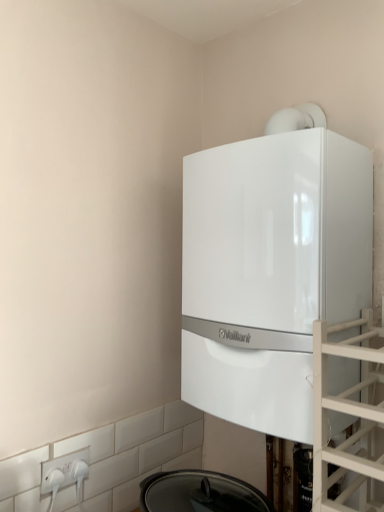
Locate an element on the screen. This screenshot has width=384, height=512. white glossy boiler at upper center is located at coordinates (270, 270).

Locate an element on the screen. home appliance lying behind the transparent glass door at right is located at coordinates (270, 270).

From the image's perspective, is transparent glass door at right above or below white glossy boiler at upper center?

From the image's perspective, transparent glass door at right appears below white glossy boiler at upper center.

Can you tell me how much transparent glass door at right and white glossy boiler at upper center differ in facing direction?

transparent glass door at right and white glossy boiler at upper center are facing 0.709 degrees away from each other.

Between transparent glass door at right and white glossy boiler at upper center, which one appears on the left side from the viewer's perspective?

white glossy boiler at upper center is more to the left.

How different are the orientations of transparent glass door at right and white plastic electric outlet at lower left in degrees?

The facing directions of transparent glass door at right and white plastic electric outlet at lower left are 90 degrees apart.

In order to click on glass door on the right of white plastic electric outlet at lower left in this screenshot , I will do `click(348, 414)`.

Is transparent glass door at right looking in the opposite direction of white plastic electric outlet at lower left?

No, transparent glass door at right is not facing the opposite direction of white plastic electric outlet at lower left.

From the image's perspective, between transparent glass door at right and white plastic electric outlet at lower left, which one is located above?

transparent glass door at right is shown above in the image.

Does white plastic electric outlet at lower left come behind transparent glass door at right?

Yes, white plastic electric outlet at lower left is further from the viewer.

Is white plastic electric outlet at lower left positioned far away from transparent glass door at right?

white plastic electric outlet at lower left is near transparent glass door at right, not far away.

The height and width of the screenshot is (512, 384). There is a white plastic electric outlet at lower left. What are the coordinates of `glass door above it (from a real-world perspective)` in the screenshot? It's located at (348, 414).

Based on the photo, is white plastic electric outlet at lower left taller than white glossy boiler at upper center?

In fact, white plastic electric outlet at lower left may be shorter than white glossy boiler at upper center.

Between white plastic electric outlet at lower left and white glossy boiler at upper center, which one has larger size?

Bigger between the two is white glossy boiler at upper center.

From the image's perspective, which is above, white plastic electric outlet at lower left or white glossy boiler at upper center?

white glossy boiler at upper center, from the image's perspective.

Consider the image. In terms of width, does white plastic electric outlet at lower left look wider or thinner when compared to white glossy boiler at upper center?

In the image, white plastic electric outlet at lower left appears to be more narrow than white glossy boiler at upper center.

From the image's perspective, between white glossy boiler at upper center and transparent glass door at right, which one is located above?

white glossy boiler at upper center, from the image's perspective.

How different are the orientations of white glossy boiler at upper center and transparent glass door at right in degrees?

white glossy boiler at upper center and transparent glass door at right are facing 0.709 degrees away from each other.

Which is less distant, (295, 306) or (365, 319)?

The point (295, 306) is in front.

Is white glossy boiler at upper center far away from transparent glass door at right?

No, white glossy boiler at upper center is not far away from transparent glass door at right.

Find the location of a particular element. This screenshot has width=384, height=512. electric outlet that is under the white glossy boiler at upper center (from a real-world perspective) is located at coordinates (65, 471).

Is white glossy boiler at upper center facing towards white plastic electric outlet at lower left?

No, white glossy boiler at upper center is not oriented towards white plastic electric outlet at lower left.

Does white glossy boiler at upper center have a greater width compared to white plastic electric outlet at lower left?

Yes, white glossy boiler at upper center is wider than white plastic electric outlet at lower left.

How distant is white glossy boiler at upper center from white plastic electric outlet at lower left?

white glossy boiler at upper center and white plastic electric outlet at lower left are 28.05 inches apart from each other.

The image size is (384, 512). In order to click on glass door below the white glossy boiler at upper center (from the image's perspective) in this screenshot , I will do `click(348, 414)`.

Find the location of `electric outlet to the left of transparent glass door at right`. electric outlet to the left of transparent glass door at right is located at coordinates (65, 471).

Considering their positions, is white glossy boiler at upper center positioned closer to white plastic electric outlet at lower left than transparent glass door at right?

The object closer to white plastic electric outlet at lower left is white glossy boiler at upper center.

From the image, which object appears to be nearer to white glossy boiler at upper center, white plastic electric outlet at lower left or transparent glass door at right?

transparent glass door at right is closer to white glossy boiler at upper center.

When comparing their distances from transparent glass door at right, does white plastic electric outlet at lower left or white glossy boiler at upper center seem further?

Based on the image, white plastic electric outlet at lower left appears to be further to transparent glass door at right.

Based on their spatial positions, is transparent glass door at right or white plastic electric outlet at lower left further from white glossy boiler at upper center?

white plastic electric outlet at lower left.

Considering their positions, is white glossy boiler at upper center positioned further to transparent glass door at right than white plastic electric outlet at lower left?

Based on the image, white plastic electric outlet at lower left appears to be further to transparent glass door at right.

Which object lies further to the anchor point white plastic electric outlet at lower left, transparent glass door at right or white glossy boiler at upper center?

Among the two, transparent glass door at right is located further to white plastic electric outlet at lower left.

Where is `home appliance located between white plastic electric outlet at lower left and transparent glass door at right in the left-right direction`? home appliance located between white plastic electric outlet at lower left and transparent glass door at right in the left-right direction is located at coordinates (270, 270).